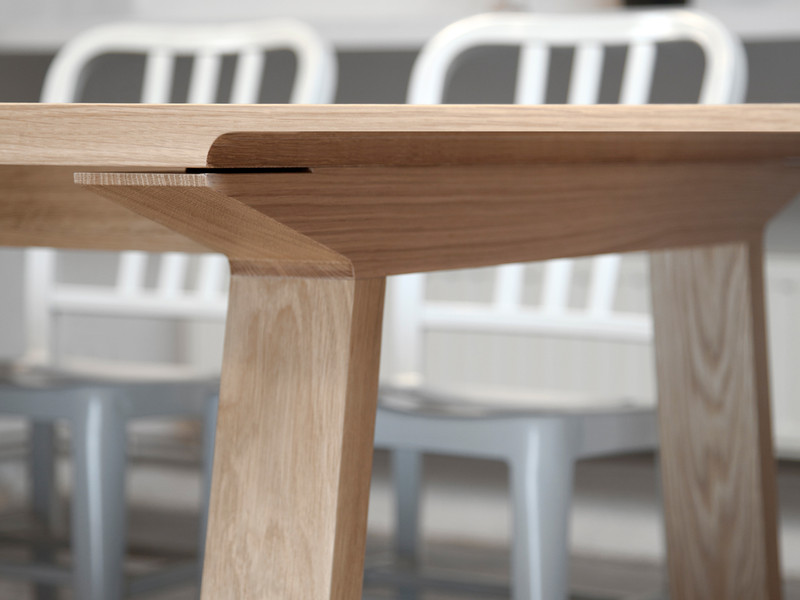
You are a GUI agent. You are given a task and a screenshot of the screen. Output one action in this format:
    pyautogui.click(x=<x>, y=<y>)
    Task: Click on the chair on right
    This screenshot has height=600, width=800.
    Given the screenshot: What is the action you would take?
    pyautogui.click(x=640, y=81)